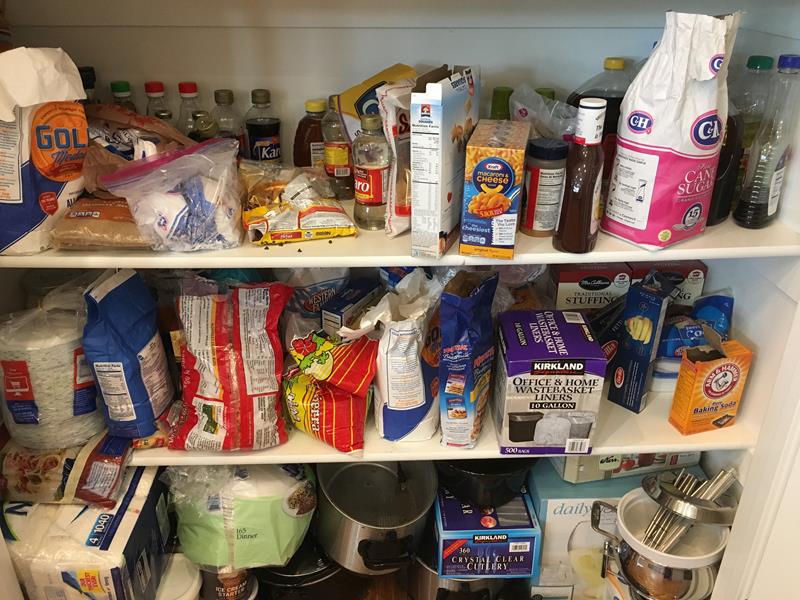
What are the coordinates of `cooking pot` in the screenshot? It's located at (362, 517).